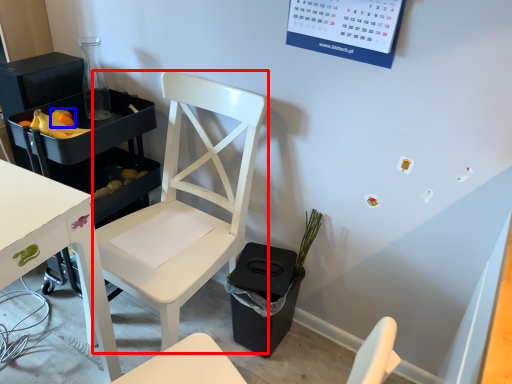
Question: Which object is further to the camera taking this photo, chair (highlighted by a red box) or fruit (highlighted by a blue box)?

Choices:
 (A) chair
 (B) fruit

Answer: (B)